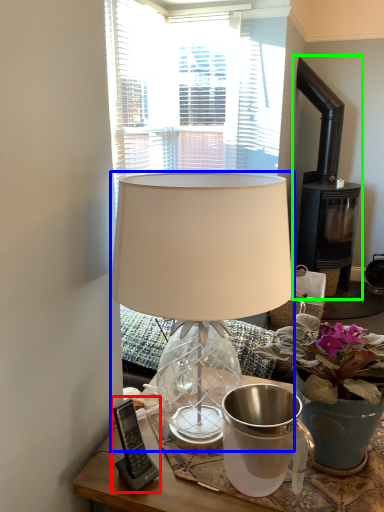
Question: Based on their relative distances, which object is farther from gadget (highlighted by a red box)? Choose from lamp (highlighted by a blue box) and fireplace (highlighted by a green box).

Choices:
 (A) lamp
 (B) fireplace

Answer: (B)